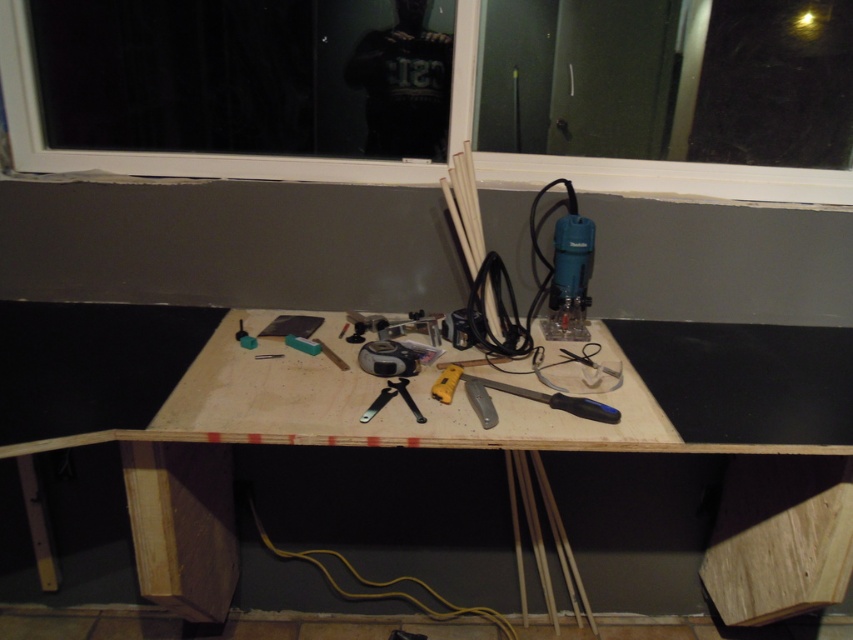
You are organizing the workspace and want to place the blue plastic saw at center on top of the plywood table at center. Is this possible based on their sizes?

The plywood table at center is taller than the blue plastic saw at center, so placing the blue plastic saw at center on top of the plywood table at center should be feasible as the table has sufficient height to accommodate the saw.